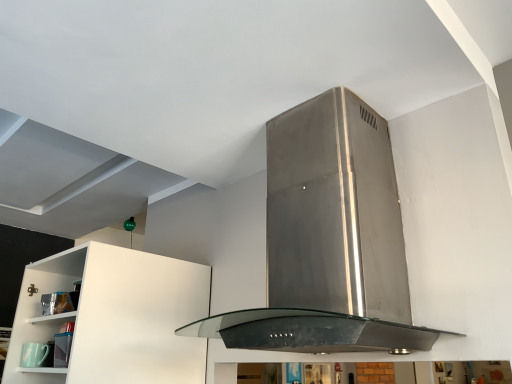
Question: Considering their positions, is matte green cup at lower left located in front of or behind stainless steel range hood at center?

Choices:
 (A) behind
 (B) front

Answer: (A)

Question: Is matte green cup at lower left bigger or smaller than stainless steel range hood at center?

Choices:
 (A) big
 (B) small

Answer: (B)

Question: Is matte green cup at lower left inside the boundaries of stainless steel range hood at center, or outside?

Choices:
 (A) outside
 (B) inside

Answer: (A)

Question: Is stainless steel range hood at center to the left or to the right of matte green cup at lower left in the image?

Choices:
 (A) right
 (B) left

Answer: (A)

Question: Do you think stainless steel range hood at center is within matte green cup at lower left, or outside of it?

Choices:
 (A) inside
 (B) outside

Answer: (B)

Question: From a real-world perspective, relative to matte green cup at lower left, is stainless steel range hood at center vertically above or below?

Choices:
 (A) below
 (B) above

Answer: (B)

Question: From their relative heights in the image, would you say stainless steel range hood at center is taller or shorter than matte green cup at lower left?

Choices:
 (A) tall
 (B) short

Answer: (A)